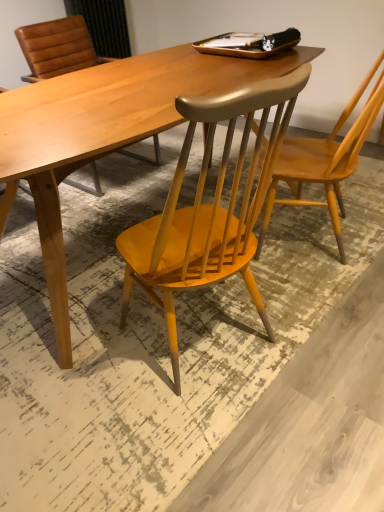
Find the location of a particular element. free point above wooden chair at center, which appears as the first chair when viewed from the left (from a real-world perspective) is located at coordinates (107, 90).